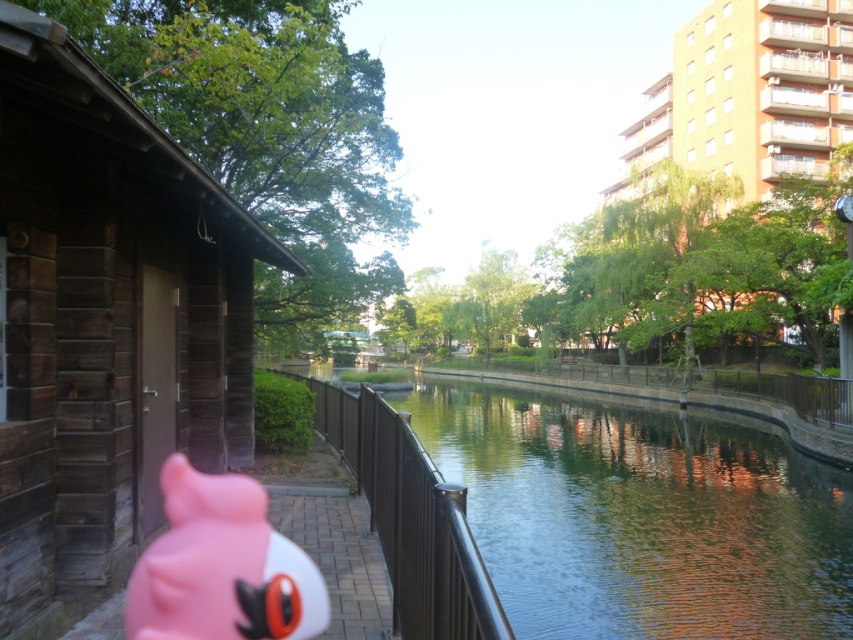
Question: Which object is farther from the camera taking this photo?

Choices:
 (A) green reflective water at center
 (B) pink rubber duck at lower left

Answer: (B)

Question: Is pink rubber duck at lower left to the left of black metal/rail at center from the viewer's perspective?

Choices:
 (A) no
 (B) yes

Answer: (B)

Question: Can you confirm if pink rubber duck at lower left is wider than black metal/rail at center?

Choices:
 (A) yes
 (B) no

Answer: (B)

Question: Considering the real-world distances, which object is farthest from the green reflective water at center?

Choices:
 (A) pink rubber duck at lower left
 (B) black metal/rail at center

Answer: (B)

Question: Considering the real-world distances, which object is closest to the green reflective water at center?

Choices:
 (A) black metal/rail at center
 (B) pink rubber duck at lower left

Answer: (B)

Question: Is green reflective water at center positioned before pink rubber duck at lower left?

Choices:
 (A) no
 (B) yes

Answer: (B)